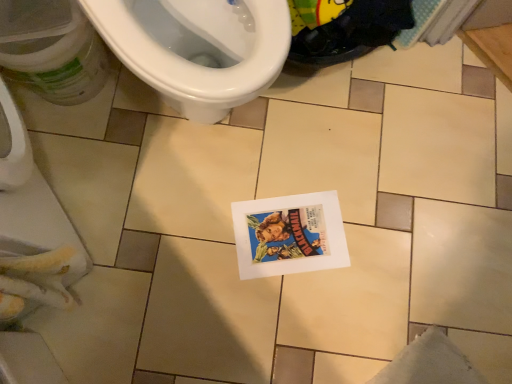
This screenshot has width=512, height=384. Identify the location of vacant space to the right of white paper comic book at center. (374, 254).